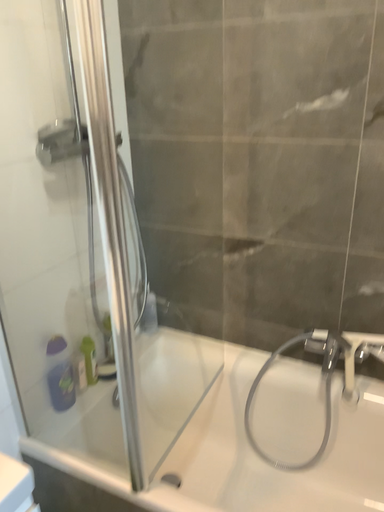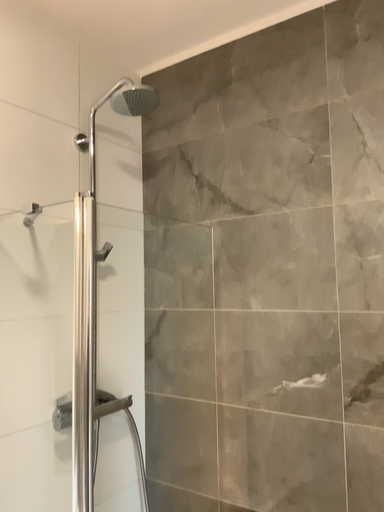
Question: Which way did the camera rotate in the video?

Choices:
 (A) rotated left
 (B) rotated right

Answer: (A)